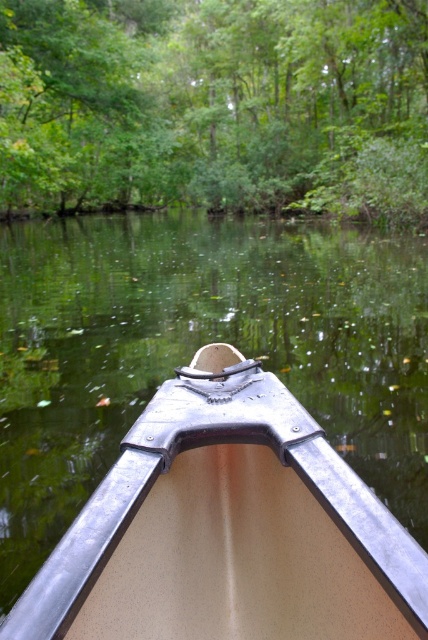
You are in a canoe and want to know which object in the scene takes up more horizontal space. Which one is wider between the green leafy tree at upper center and the metallic tan boat at center?

The green leafy tree at upper center is wider than the metallic tan boat at center.

You are in a canoe and want to know what is located at the coordinates point (214, 106). What object is there?

The point (214, 106) indicates a green leafy tree at upper center.

You are in a canoe and want to reach the metallic tan boat at center. There is a green leafy tree at upper center in your path. Can you safely navigate around the tree to reach the boat?

The green leafy tree at upper center is 36.04 meters away from the metallic tan boat at center. Since the tree is in the path towards the boat, you can navigate around it as long as there is enough space between the tree and the water to maneuver the canoe safely.